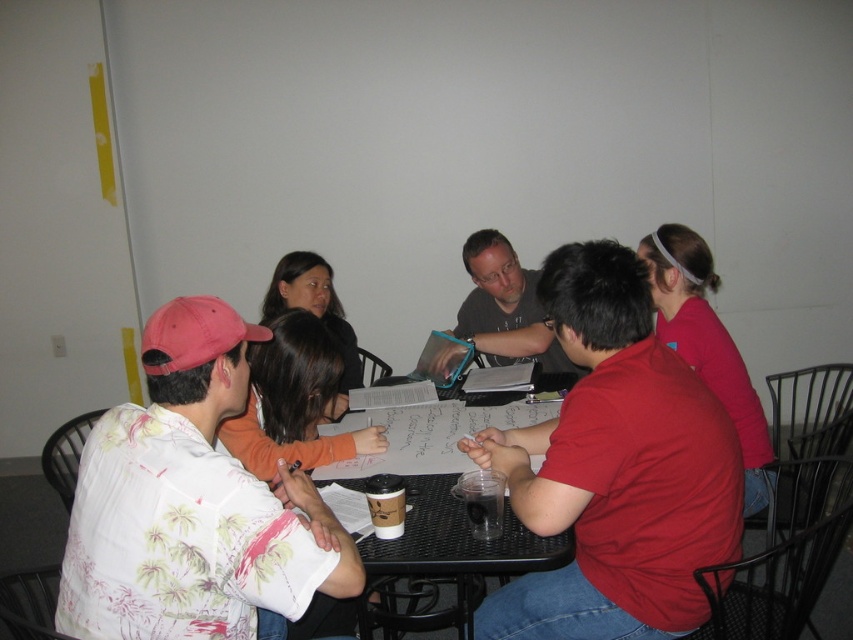
Can you confirm if red matte shirt at center is positioned above white floral shirt at left?

Yes.

Does point (631, 508) come closer to viewer compared to point (115, 531)?

No.

Find the location of a particular element. red matte shirt at center is located at coordinates (614, 468).

Is point (624, 634) closer to camera compared to point (440, 502)?

Yes.

Describe the element at coordinates (614, 468) in the screenshot. The width and height of the screenshot is (853, 640). I see `red matte shirt at center` at that location.

The width and height of the screenshot is (853, 640). What are the coordinates of `red matte shirt at center` in the screenshot? It's located at 614,468.

Does black plastic table at center appear under dark gray shirt at center?

Yes.

The image size is (853, 640). What do you see at coordinates (445, 552) in the screenshot?
I see `black plastic table at center` at bounding box center [445, 552].

Locate an element on the screen. black plastic table at center is located at coordinates (445, 552).